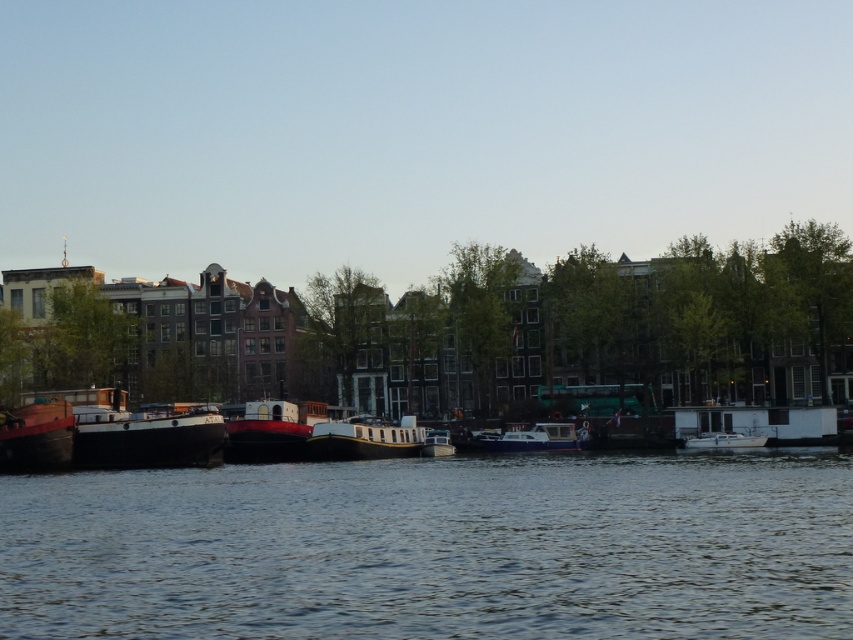
You are standing at the riverside and want to know how far the point at coordinates (573,440) is from your current position. Can you determine the distance?

The distance of point (573,440) from camera is 395.57 feet.

You are a small toy boat that is 1 meter long. You want to sail from the white matte boat at left to the smooth water at center. Is there enough space for you to pass through the area between them?

The smooth water at center might be wider than white matte boat at left, so there is likely enough space for the toy boat to pass through since the width between them could accommodate its 1 meter length.